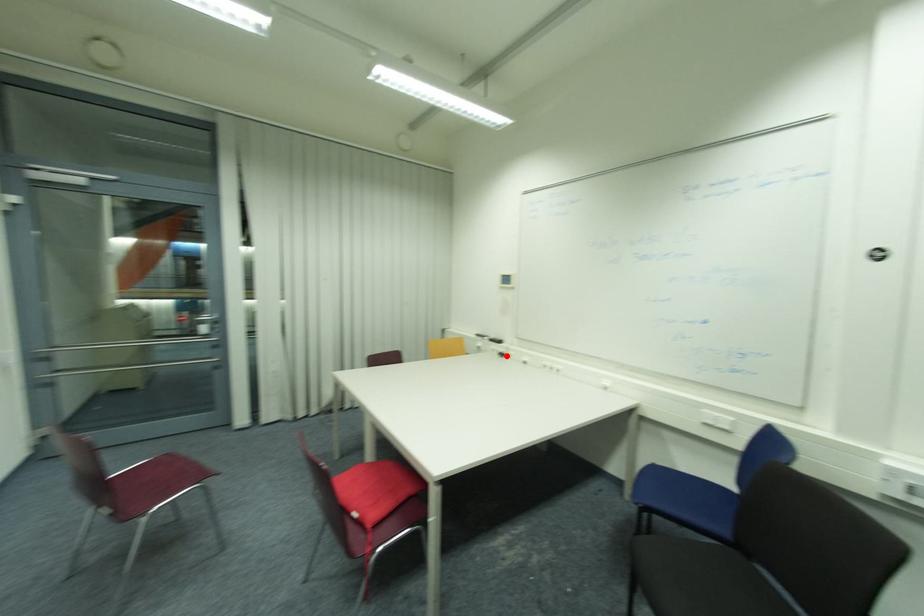
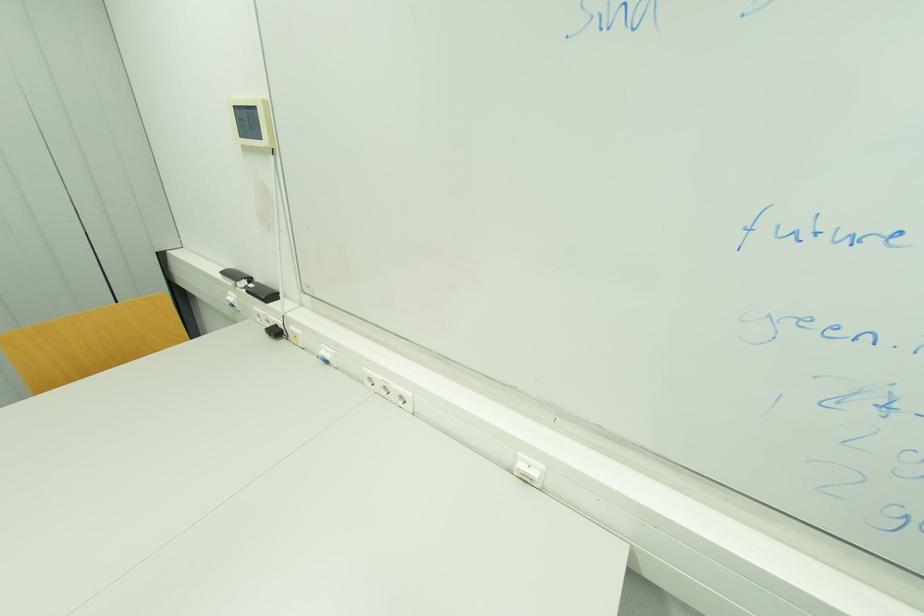
The point at the highlighted location is marked in the first image. Where is the corresponding point in the second image?

(281, 333)